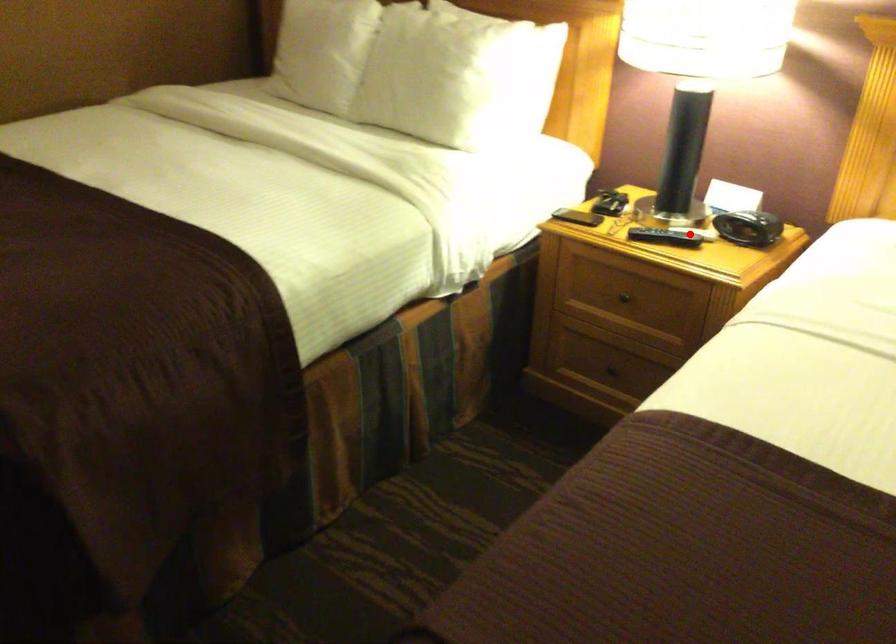
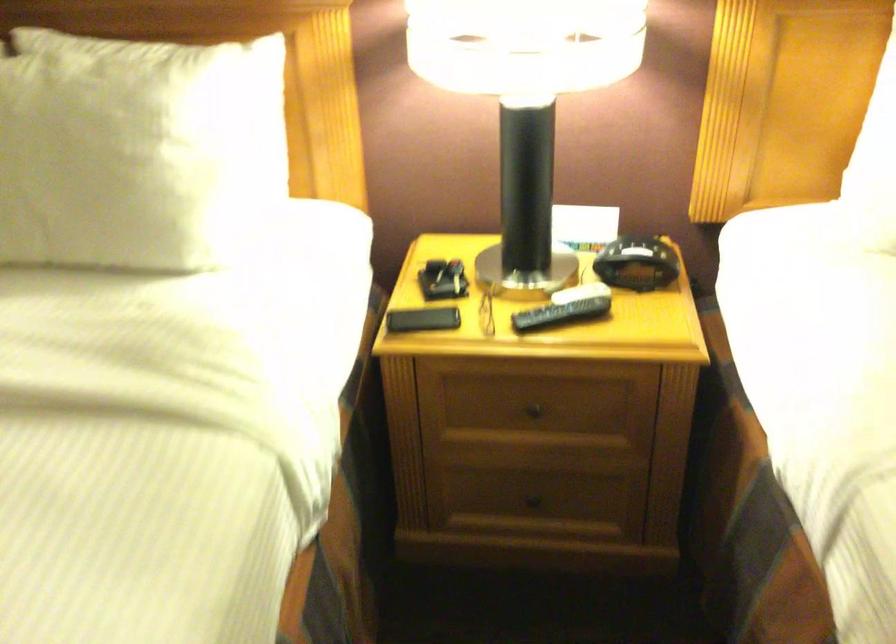
Question: A red point is marked in image1. In image2, is the corresponding 3D point closer to the camera or farther? Reply with the corresponding letter.

Choices:
 (A) The corresponding 3D point is closer.
 (B) The corresponding 3D point is farther.

Answer: (A)